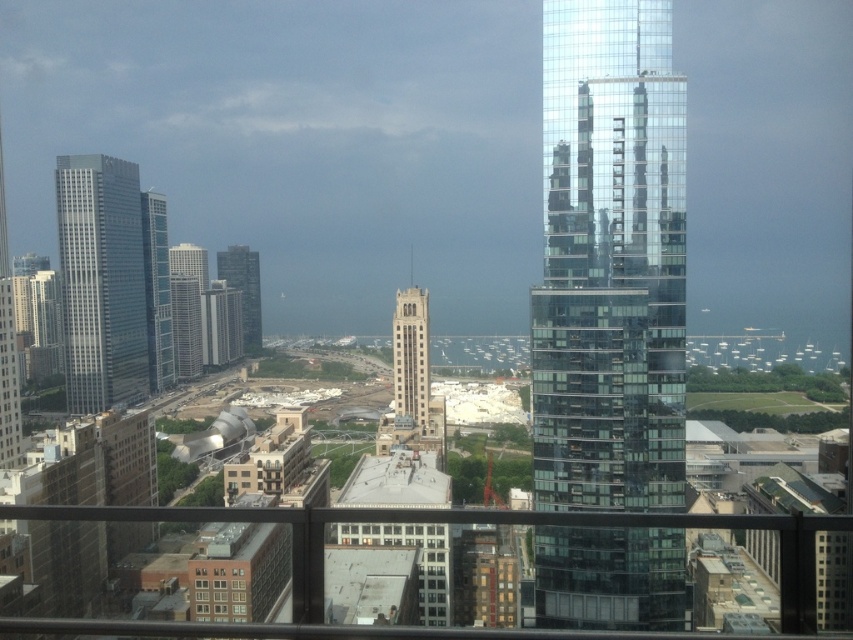
You are standing at the center of the city balcony and want to take a photo of the transparent glass skyscraper at center. Which direction should you face to ensure the skyscraper is in the center of your photo?

The transparent glass skyscraper at center is already located at the center of the image, so facing the direction where the transparent glass skyscraper at center is positioned will keep it centered in your photo.